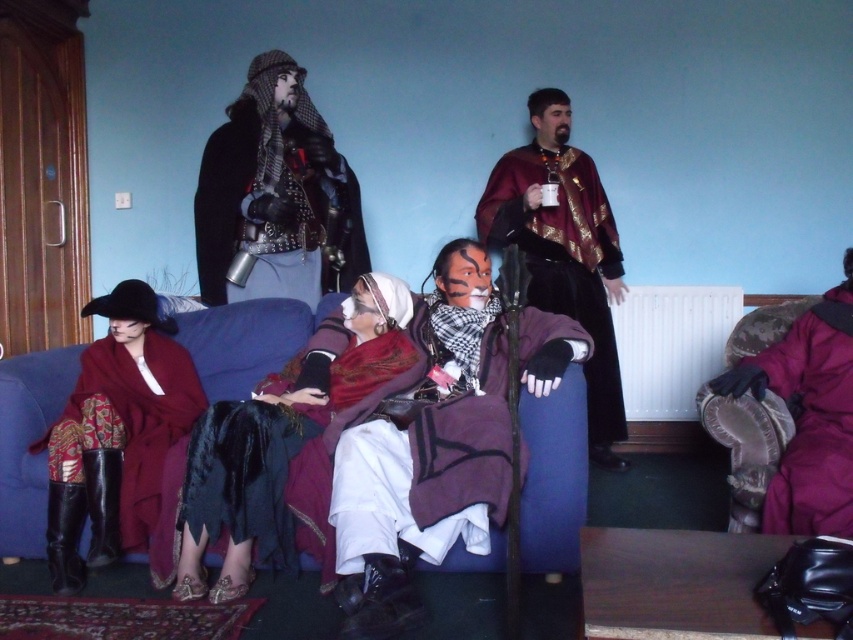
You are standing in the living room and want to reach a point that is 2.61 meters away from the camera. Is the point at coordinates point (35, 454) within that distance?

Yes, the point at point (35, 454) is exactly 2.61 meters from the camera, so it is within the desired distance.

You are a photographer setting up for a group photo in the living room. You need to position the blue fabric couch at center and the velvet maroon cape at center so that the couch is on the left side of the cape. Is the current arrangement correct?

Yes, the current arrangement is correct because the blue fabric couch at center is already positioned to the left of the velvet maroon cape at center as described in the Objects Description.